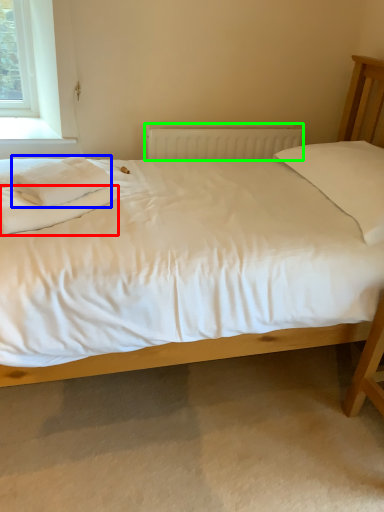
Question: Considering the real-world distances, which object is farthest from sheet (highlighted by a red box)? material (highlighted by a blue box) or radiator (highlighted by a green box)?

Choices:
 (A) material
 (B) radiator

Answer: (B)